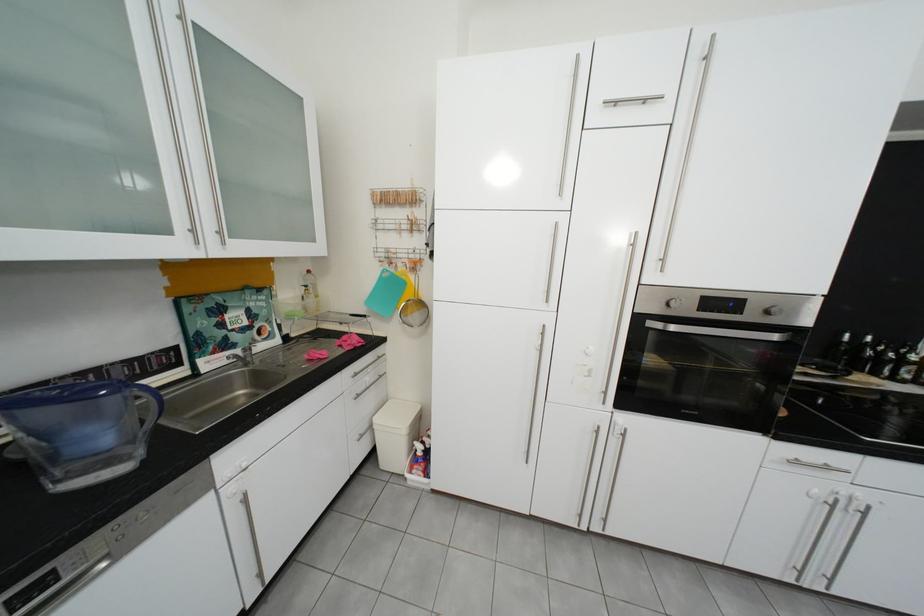
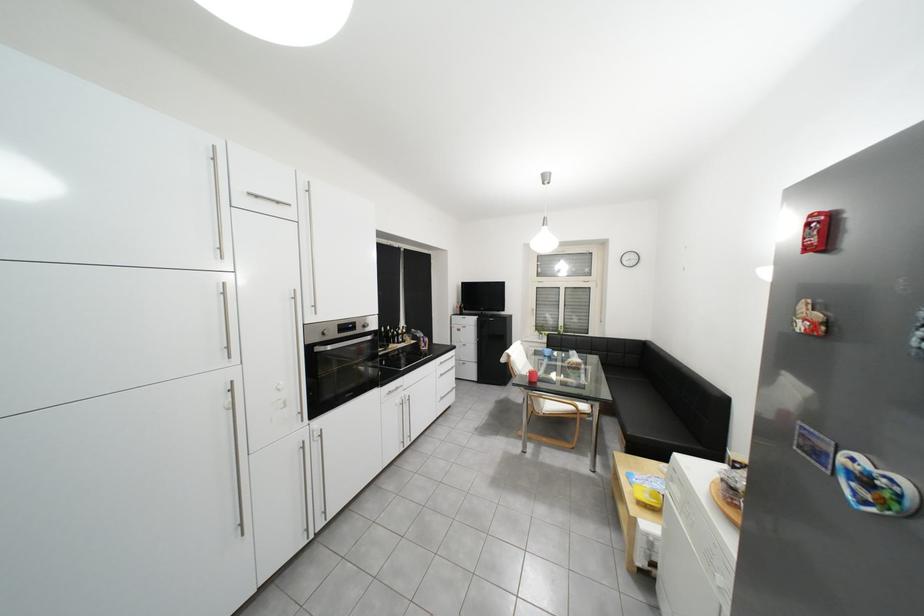
Locate, in the second image, the point that corresponds to (x=786, y=339) in the first image.

(381, 339)